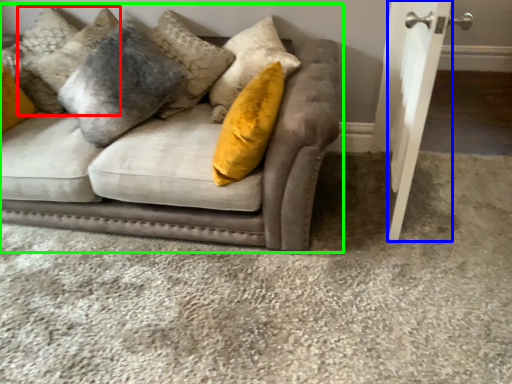
Question: Estimate the real-world distances between objects in this image. Which object is closer to pillow (highlighted by a red box), door (highlighted by a blue box) or studio couch (highlighted by a green box)?

Choices:
 (A) door
 (B) studio couch

Answer: (B)